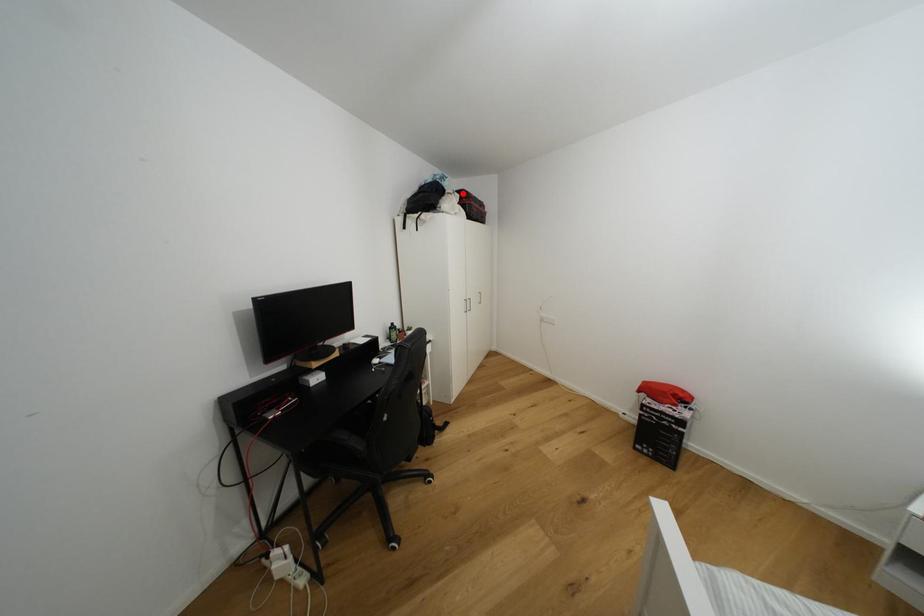
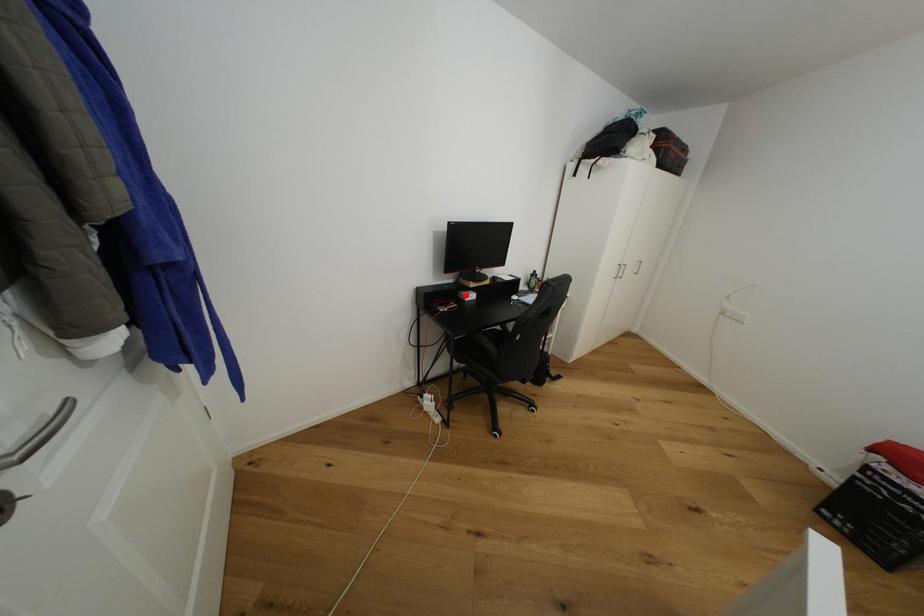
I am providing you with two images of the same scene from different viewpoints. A red point is marked on the first image and another point is marked on the second image. Does the point marked in image1 correspond to the same location as the one in image2?

No